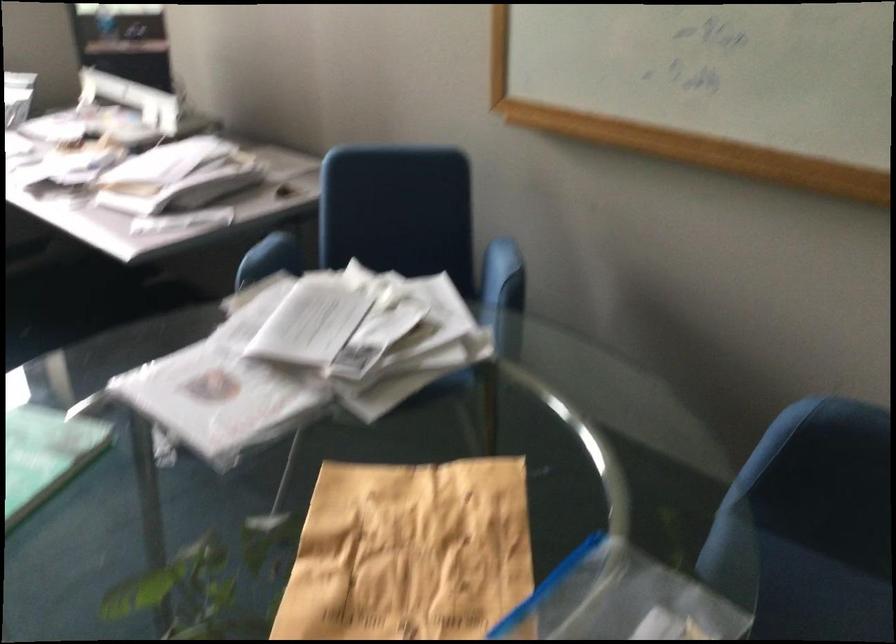
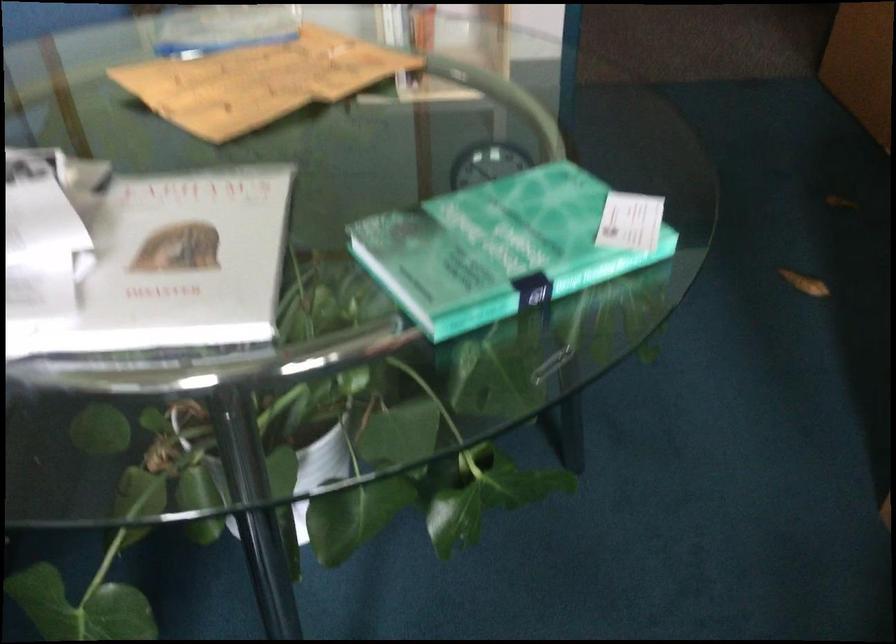
The point at (167, 417) is marked in the first image. Where is the corresponding point in the second image?

(186, 259)